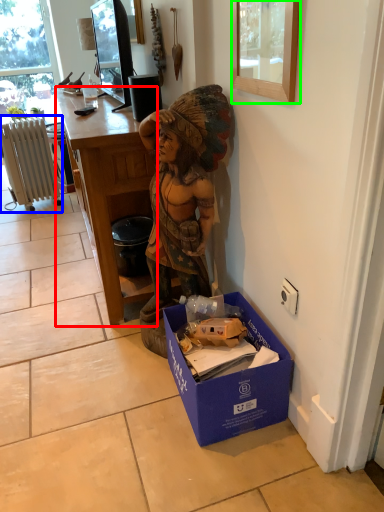
Question: Which is farther away from desk (highlighted by a red box)? radiator (highlighted by a blue box) or picture frame (highlighted by a green box)?

Choices:
 (A) radiator
 (B) picture frame

Answer: (A)